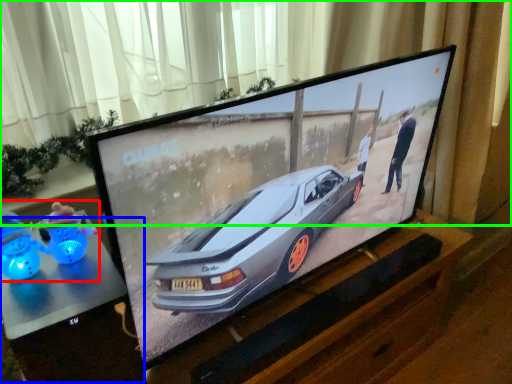
Question: Which object is the closest to the toy (highlighted by a red box)? Choose among these: table (highlighted by a blue box) or curtain (highlighted by a green box).

Choices:
 (A) table
 (B) curtain

Answer: (A)